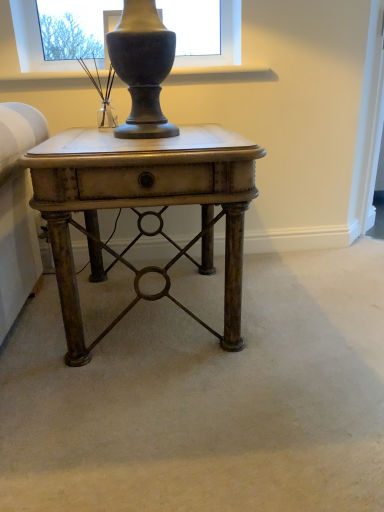
This screenshot has width=384, height=512. What do you see at coordinates (143, 206) in the screenshot? I see `matte brown wood table at center` at bounding box center [143, 206].

Identify the location of matte brown wood table at center. This screenshot has height=512, width=384. (143, 206).

In order to face matte brown wood table at center, should I rotate leftwards or rightwards?

A 5.365 degree turn to the left will do.

Measure the distance between point (231, 195) and camera.

Point (231, 195) is 1.06 meters from camera.

Identify the location of matte brown wood table at center. coord(143,206).